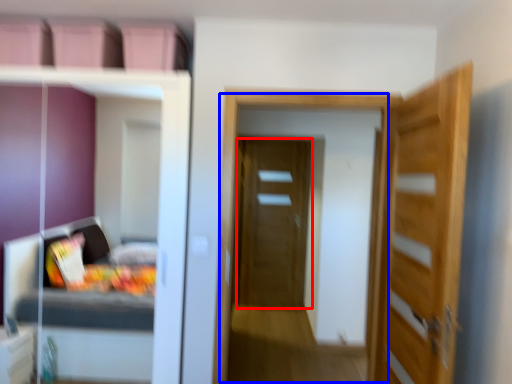
Question: Among these objects, which one is nearest to the camera, door (highlighted by a red box) or screen door (highlighted by a blue box)?

Choices:
 (A) door
 (B) screen door

Answer: (B)